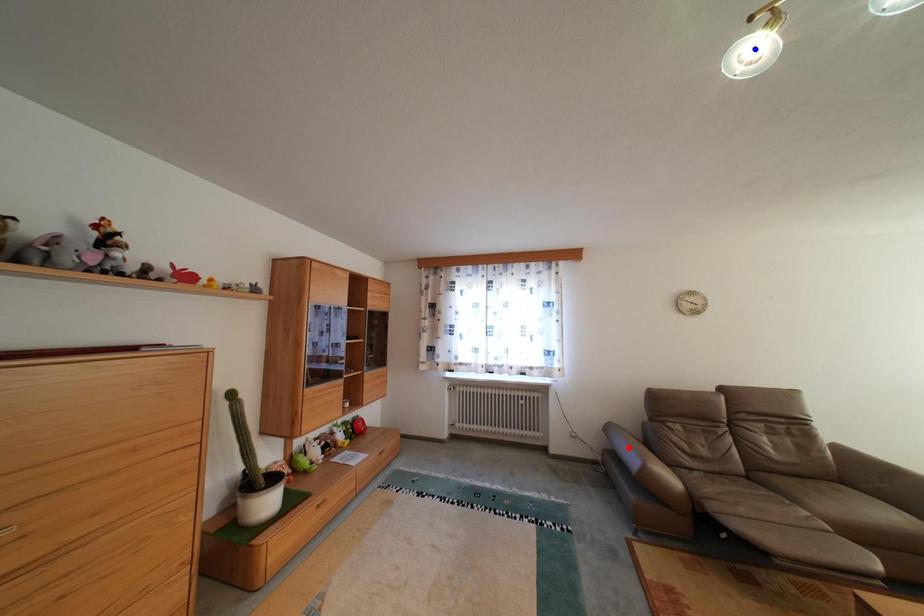
Question: Two points are marked on the image. Which point is closer to the camera?

Choices:
 (A) Blue point is closer.
 (B) Red point is closer.

Answer: (A)